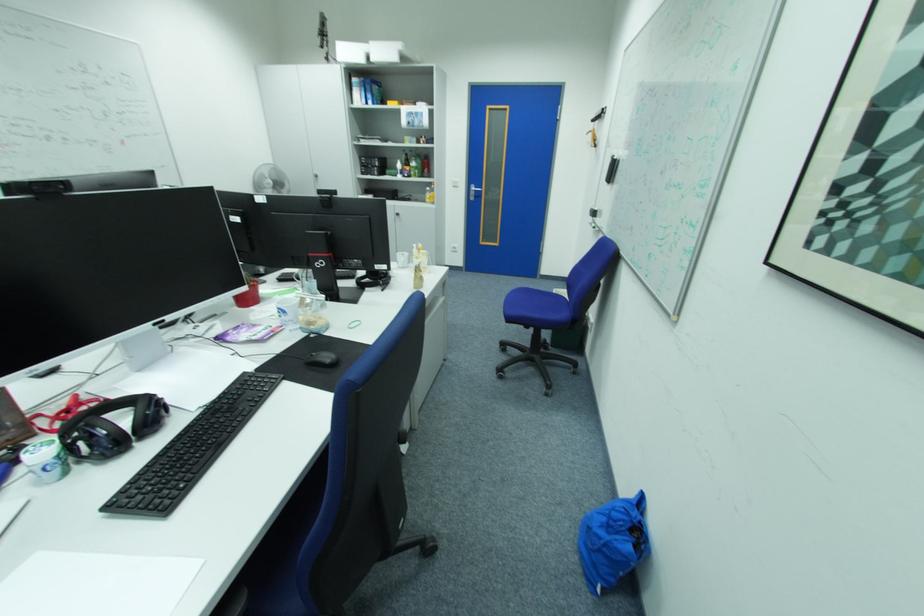
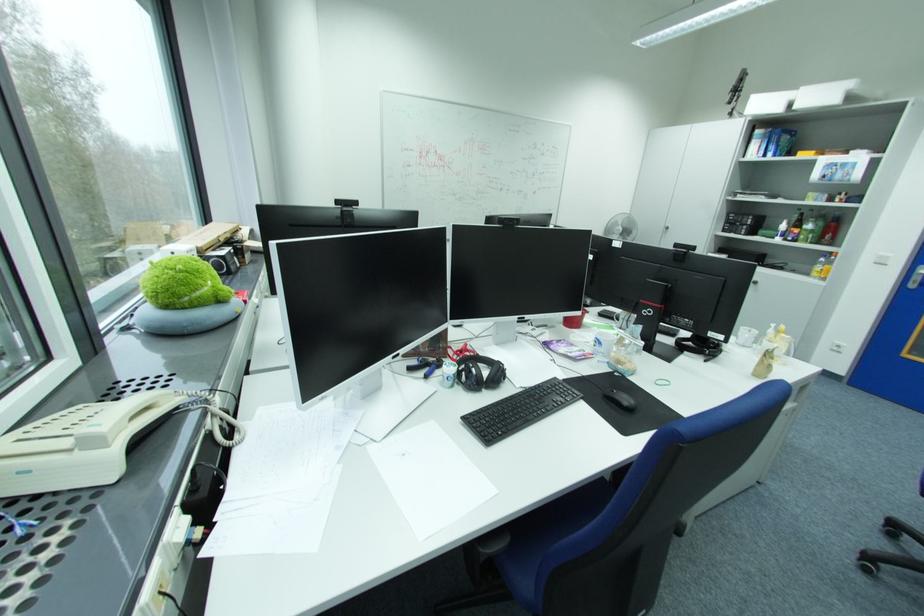
In the second image, find the point that corresponds to (195,437) in the first image.

(518, 402)